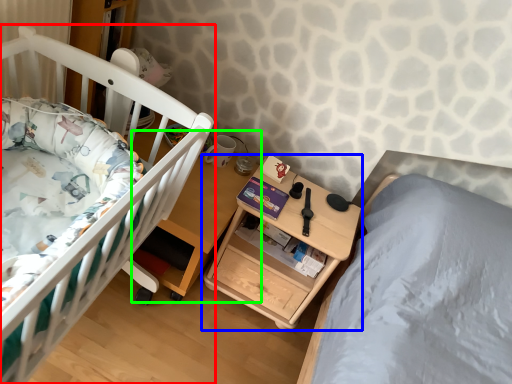
Question: Considering the real-world distances, which object is closest to infant bed (highlighted by a red box)? nightstand (highlighted by a blue box) or table (highlighted by a green box).

Choices:
 (A) nightstand
 (B) table

Answer: (B)